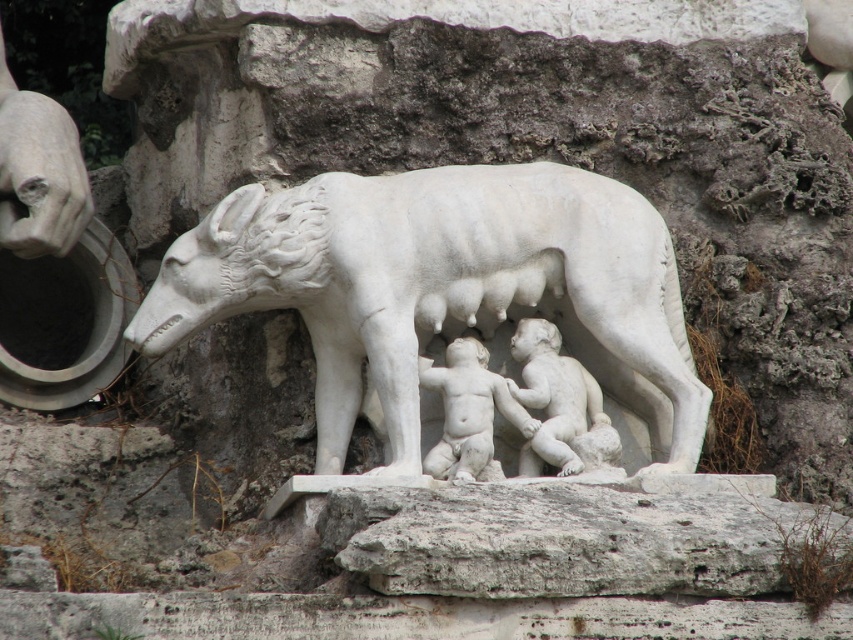
Does white marble wolf at center have a lesser width compared to white marble babies at center?

In fact, white marble wolf at center might be wider than white marble babies at center.

Is white marble wolf at center behind white marble babies at center?

No, white marble wolf at center is in front of white marble babies at center.

Where is `white marble wolf at center`? The image size is (853, 640). white marble wolf at center is located at coordinates (442, 289).

The width and height of the screenshot is (853, 640). What are the coordinates of `white marble wolf at center` in the screenshot? It's located at (442, 289).

Does point (619, 444) come farther from viewer compared to point (440, 435)?

No, it is in front of (440, 435).

Between white marble babies at center and smooth white cherub at center, which one has less height?

white marble babies at center

Identify the location of white marble babies at center. This screenshot has width=853, height=640. (553, 397).

Is white marble wolf at center smaller than smooth white cherub at center?

Incorrect, white marble wolf at center is not smaller in size than smooth white cherub at center.

Does white marble wolf at center have a lesser height compared to smooth white cherub at center?

In fact, white marble wolf at center may be taller than smooth white cherub at center.

Is point (482, 252) farther from viewer compared to point (538, 422)?

Yes.

Find the location of a particular element. This screenshot has height=640, width=853. white marble wolf at center is located at coordinates 442,289.